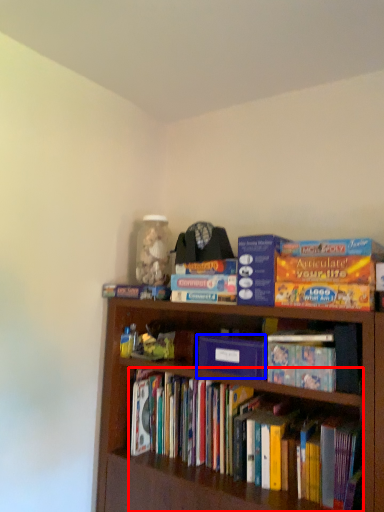
Question: Among these objects, which one is nearest to the camera, book (highlighted by a red box) or paperback book (highlighted by a blue box)?

Choices:
 (A) book
 (B) paperback book

Answer: (A)